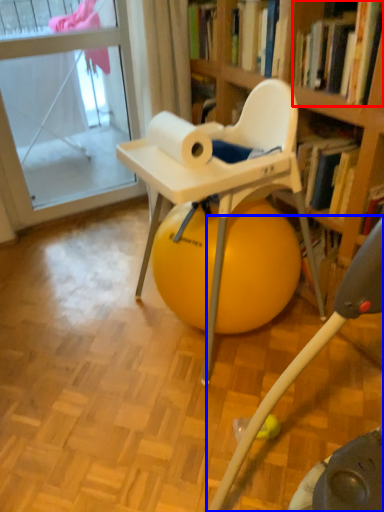
Question: Which object appears closest to the camera in this image, book (highlighted by a red box) or feeding chair (highlighted by a blue box)?

Choices:
 (A) book
 (B) feeding chair

Answer: (B)